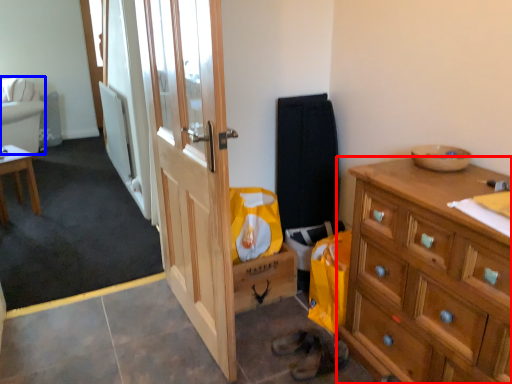
Question: Which object is further to the camera taking this photo, cabinetry (highlighted by a red box) or studio couch (highlighted by a blue box)?

Choices:
 (A) cabinetry
 (B) studio couch

Answer: (B)